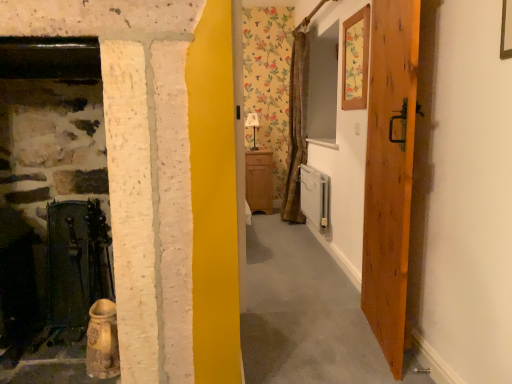
Question: Is wooden picture frame at upper right in front of or behind matte wood cabinet at center in the image?

Choices:
 (A) behind
 (B) front

Answer: (B)

Question: Looking at their shapes, would you say wooden picture frame at upper right is wider or thinner than matte wood cabinet at center?

Choices:
 (A) wide
 (B) thin

Answer: (B)

Question: Which of these objects is positioned closest to the white glossy radiator at lower right?

Choices:
 (A) wooden door at right
 (B) wooden picture frame at upper right
 (C) matte wood cabinet at center
 (D) matte white lamp at center

Answer: (C)

Question: Which is farther from the matte white lamp at center?

Choices:
 (A) wooden picture frame at upper right
 (B) white glossy radiator at lower right
 (C) matte wood cabinet at center
 (D) wooden door at right

Answer: (D)